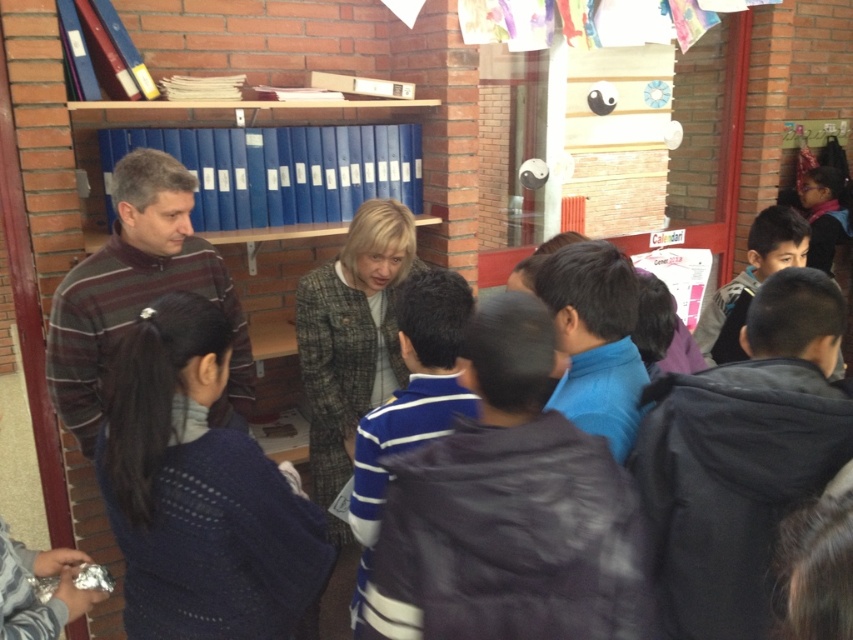
Question: Among these objects, which one is farthest from the camera?

Choices:
 (A) knitted blue sweater at lower left
 (B) blue plastic file folders at upper center

Answer: (B)

Question: Is knitted blue sweater at lower left further to camera compared to striped wool sweater at left?

Choices:
 (A) no
 (B) yes

Answer: (A)

Question: Which object appears farthest from the camera in this image?

Choices:
 (A) blue plastic file folders at upper center
 (B) blue striped shirt at right

Answer: (B)

Question: Can you confirm if striped wool sweater at left is bigger than blue striped sweater at center?

Choices:
 (A) yes
 (B) no

Answer: (B)

Question: Can you confirm if knitted blue sweater at lower left is bigger than blue striped sweater at center?

Choices:
 (A) yes
 (B) no

Answer: (B)

Question: Based on their relative distances, which object is nearer to the blue plastic file folders at upper center?

Choices:
 (A) striped wool sweater at left
 (B) blue striped sweater at center
 (C) gray tweed jacket at center

Answer: (A)